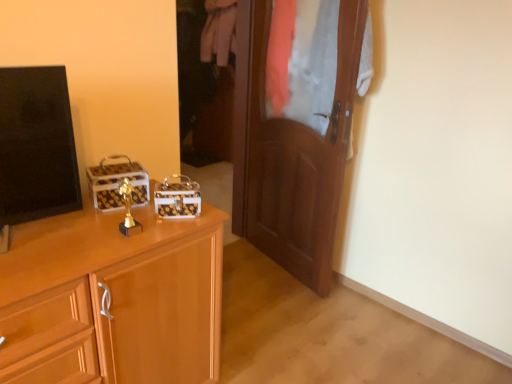
Question: Looking at their shapes, would you say white cotton pants at center is wider or thinner than black glossy tv at left?

Choices:
 (A) thin
 (B) wide

Answer: (B)

Question: Is point (205, 31) positioned closer to the camera than point (69, 163)?

Choices:
 (A) farther
 (B) closer

Answer: (A)

Question: Which of these objects is positioned farthest from the wooden door at center?

Choices:
 (A) black glossy tv at left
 (B) matte wood cabinet at left
 (C) white cotton pants at center

Answer: (C)

Question: Considering the real-world distances, which object is closest to the matte wood cabinet at left?

Choices:
 (A) white cotton pants at center
 (B) wooden door at center
 (C) black glossy tv at left

Answer: (C)